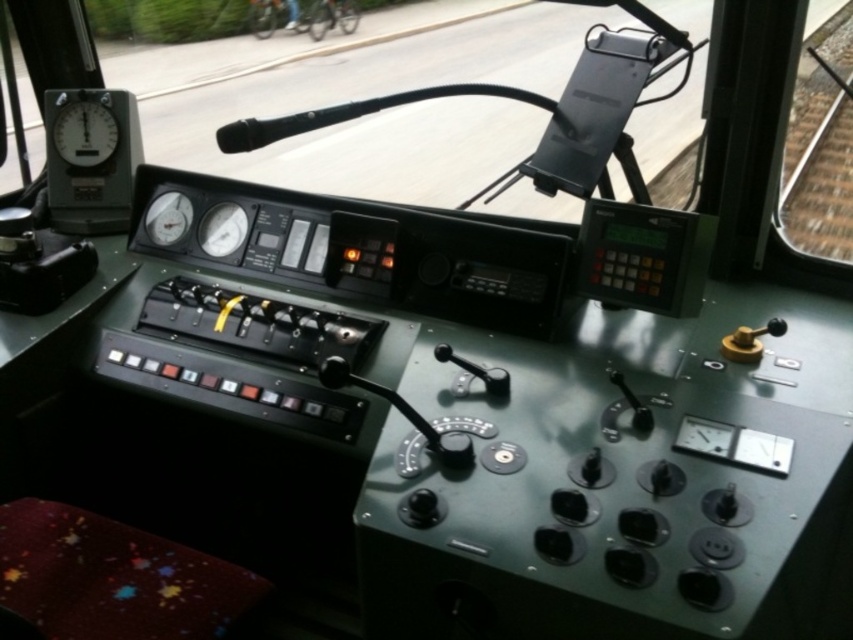
Is matte black gauge at upper left below metallic bicycle at upper center?

Yes, matte black gauge at upper left is below metallic bicycle at upper center.

From the picture: Does matte black gauge at upper left appear on the right side of metallic bicycle at upper center?

Correct, you'll find matte black gauge at upper left to the right of metallic bicycle at upper center.

You are a GUI agent. You are given a task and a screenshot of the screen. Output one action in this format:
    pyautogui.click(x=<x>, y=<y>)
    Task: Click on the matte black gauge at upper left
    The width and height of the screenshot is (853, 640).
    Given the screenshot: What is the action you would take?
    click(x=84, y=132)

Does matte black gauge at upper left appear on the left side of metallic bicycle at center?

Yes, matte black gauge at upper left is to the left of metallic bicycle at center.

Does point (67, 136) come farther from viewer compared to point (325, 8)?

No, it is not.

The image size is (853, 640). I want to click on matte black gauge at upper left, so click(x=84, y=132).

Does metallic bicycle at upper center have a lesser height compared to metallic bicycle at center?

Yes.

Between point (252, 26) and point (352, 19), which one is positioned in front?

Point (252, 26)

The image size is (853, 640). Describe the element at coordinates (276, 17) in the screenshot. I see `metallic bicycle at upper center` at that location.

Identify the location of metallic bicycle at upper center. This screenshot has width=853, height=640. (276, 17).